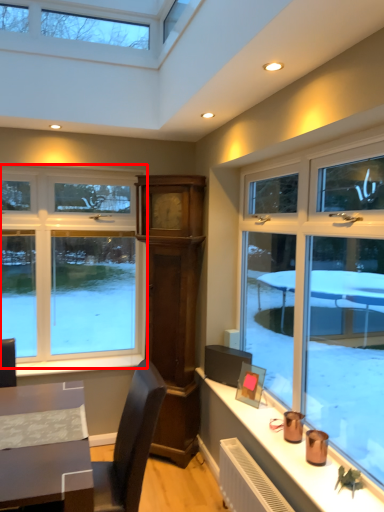
Question: From the image's perspective, where is window (annotated by the red box) located relative to window sill?

Choices:
 (A) below
 (B) above

Answer: (B)